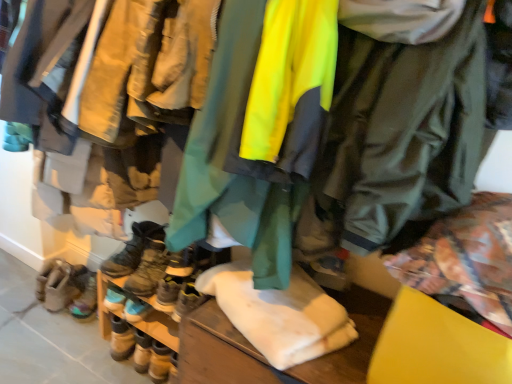
Question: Is green matte jacket at center, the 1th jacket in the right-to-left sequence, aimed at multicolored suede boots at lower left, which is counted as the second footwear, starting from the left?

Choices:
 (A) no
 (B) yes

Answer: (A)

Question: Is green matte jacket at center, the 2th jacket viewed from the left, touching multicolored suede boots at lower left, which is counted as the second footwear, starting from the left?

Choices:
 (A) yes
 (B) no

Answer: (B)

Question: Considering the relative sizes of green matte jacket at center, the 1th jacket in the right-to-left sequence, and multicolored suede boots at lower left, which is counted as the second footwear, starting from the left, in the image provided, is green matte jacket at center, the 1th jacket in the right-to-left sequence, bigger than multicolored suede boots at lower left, which is counted as the second footwear, starting from the left,?

Choices:
 (A) no
 (B) yes

Answer: (B)

Question: From a real-world perspective, is green matte jacket at center, the 1th jacket in the right-to-left sequence, beneath multicolored suede boots at lower left, which is counted as the second footwear, starting from the left?

Choices:
 (A) yes
 (B) no

Answer: (B)

Question: From the image's perspective, is green matte jacket at center, the 1th jacket in the right-to-left sequence, beneath multicolored suede boots at lower left, which is counted as the second footwear, starting from the left?

Choices:
 (A) yes
 (B) no

Answer: (B)

Question: Does green matte jacket at center, the 1th jacket in the right-to-left sequence, have a smaller size compared to multicolored suede boots at lower left, which ranks as the fourth footwear in right-to-left order?

Choices:
 (A) no
 (B) yes

Answer: (A)

Question: Is leather boots at lower left, the 5th footwear when ordered from right to left, further to the viewer compared to leather boots at lower left, acting as the 2th footwear starting from the right?

Choices:
 (A) no
 (B) yes

Answer: (B)

Question: From the image's perspective, is leather boots at lower left, the 5th footwear when ordered from right to left, beneath leather boots at lower left, acting as the 2th footwear starting from the right?

Choices:
 (A) yes
 (B) no

Answer: (B)

Question: Is leather boots at lower left, placed as the 1th footwear when sorted from left to right, oriented towards leather boots at lower left, acting as the 2th footwear starting from the right?

Choices:
 (A) yes
 (B) no

Answer: (B)

Question: Can you confirm if leather boots at lower left, the 5th footwear when ordered from right to left, is wider than leather boots at lower left, the 4th footwear positioned from the left?

Choices:
 (A) no
 (B) yes

Answer: (B)

Question: Is leather boots at lower left, placed as the 1th footwear when sorted from left to right, outside of leather boots at lower left, the 4th footwear positioned from the left?

Choices:
 (A) yes
 (B) no

Answer: (A)

Question: Is leather boots at lower left, placed as the 1th footwear when sorted from left to right, positioned far away from leather boots at lower left, the 4th footwear positioned from the left?

Choices:
 (A) yes
 (B) no

Answer: (B)

Question: Is multicolored suede boots at lower left, which ranks as the fourth footwear in right-to-left order, not within leather boots at lower left, placed as the 1th footwear when sorted from left to right?

Choices:
 (A) no
 (B) yes

Answer: (B)